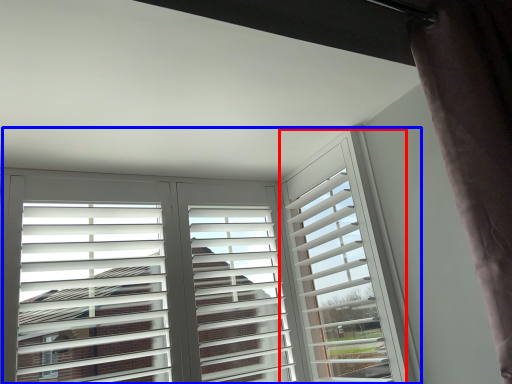
Question: Among these objects, which one is nearest to the camera, window frame (highlighted by a red box) or window (highlighted by a blue box)?

Choices:
 (A) window frame
 (B) window

Answer: (B)